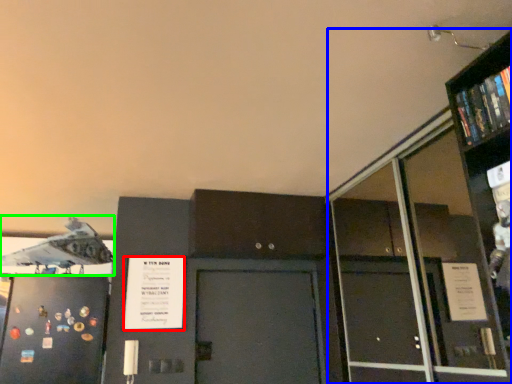
Question: Which object is the closest to the poster (highlighted by a red box)? Choose among these: bookcase (highlighted by a blue box) or airplane (highlighted by a green box).

Choices:
 (A) bookcase
 (B) airplane

Answer: (B)